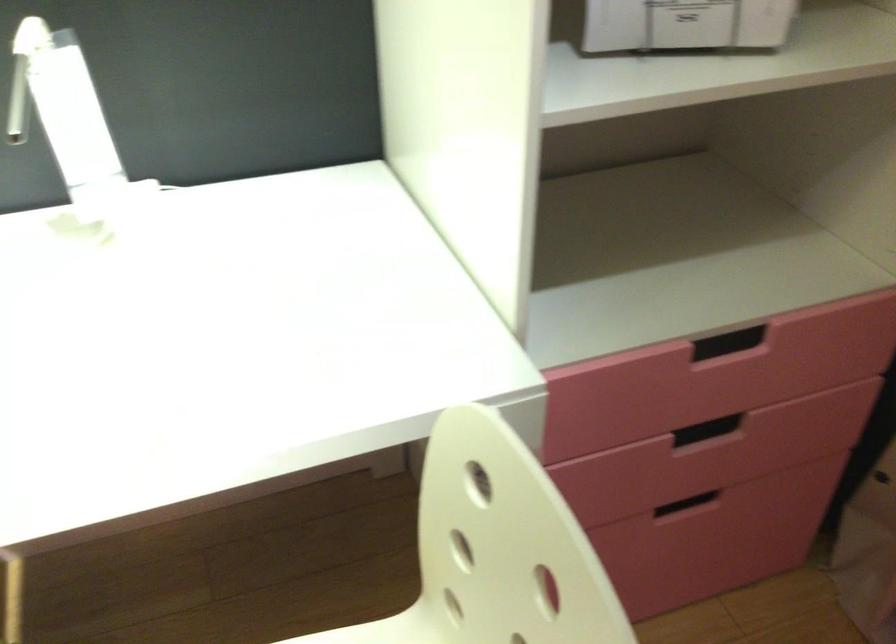
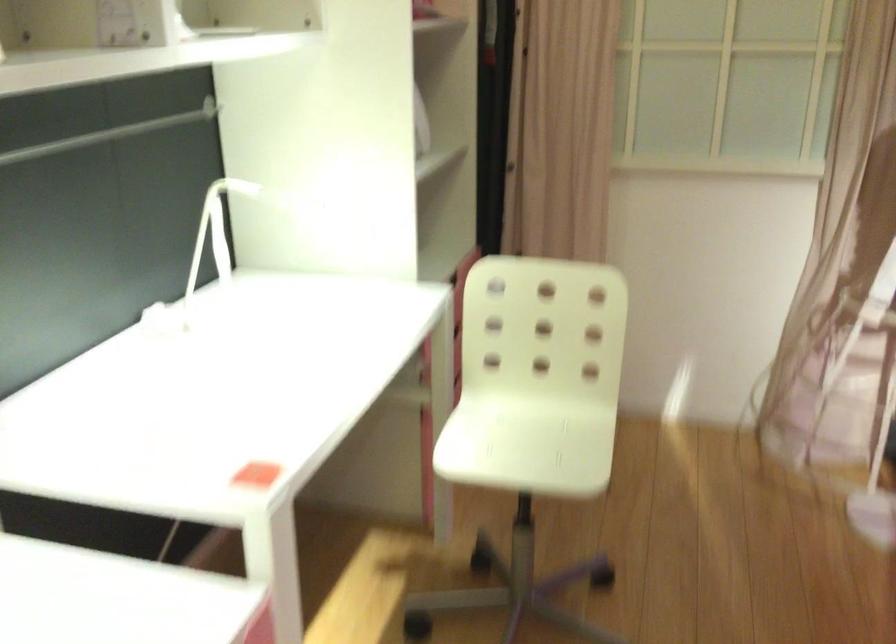
The point at (76, 104) is marked in the first image. Where is the corresponding point in the second image?

(213, 234)